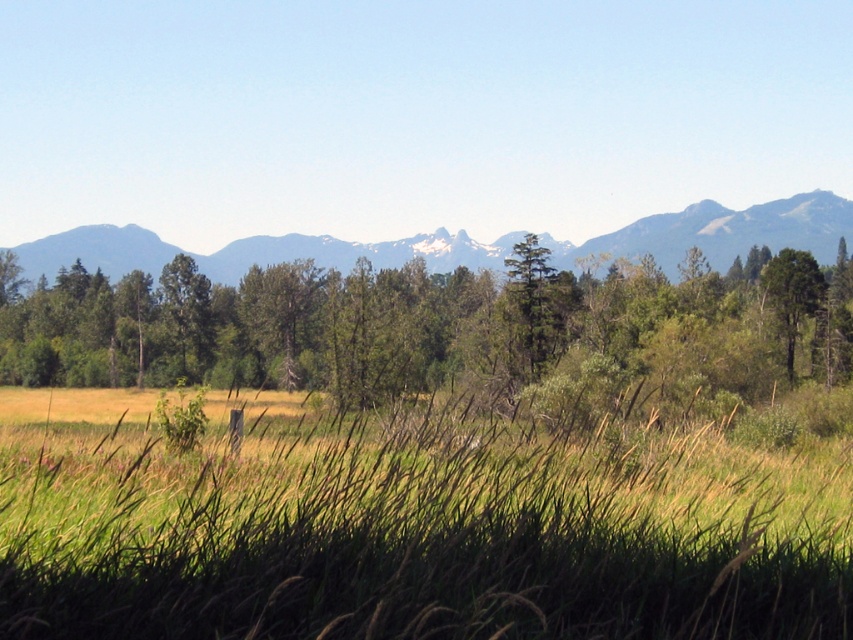
You are standing in the middle of the field of tall grasses and wildflowers in the foreground. You see two points marked in the scene. The first point is at coordinates point (471, 573) and the second point is at coordinates point (601, 241). Which point is closer to you?

Point (471, 573) is in front of point (601, 241), so the first point is closer to you.